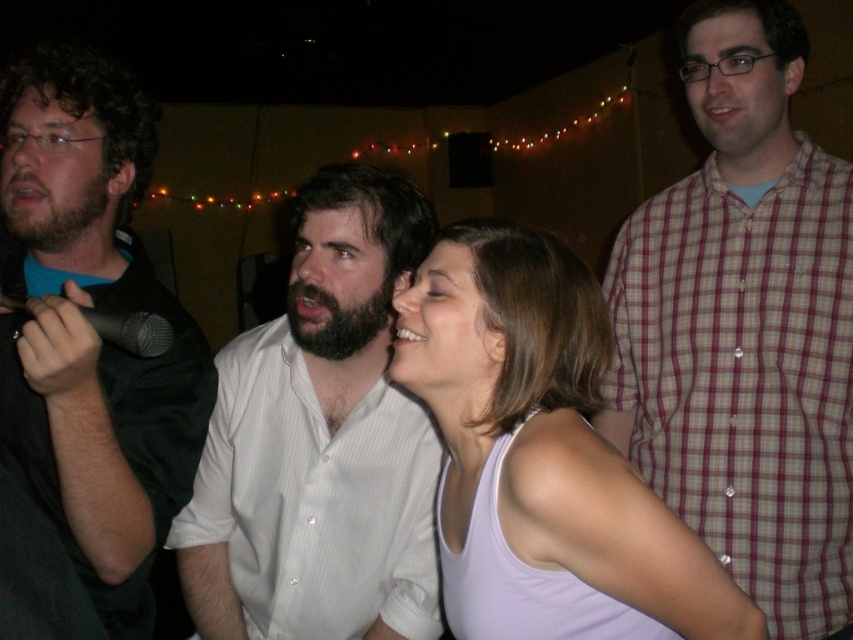
You are organizing a clothing donation drive and need to sort items by size. You have two items to categorize in the image provided. Which of the two items, the plaid shirt at right or the white tank top at center, should be placed in the larger size bin?

The plaid shirt at right should be placed in the larger size bin because it is bigger than the white tank top at center.

You are organizing a clothing display and need to arrange the white striped shirt at center and the matte black shirt at left based on their sizes. Which shirt should be placed on the wider hanger?

The white striped shirt at center should be placed on the wider hanger since its width surpasses that of the matte black shirt at left.

You are at a party and want to find the tallest person between the plaid shirt at right and the white tank top at center. Which one should you look for?

The plaid shirt at right is much taller than the white tank top at center, so you should look for the plaid shirt at right.